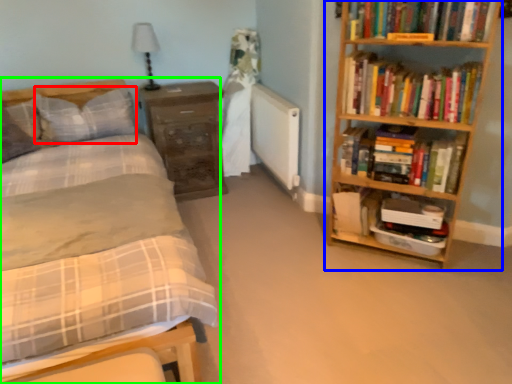
Question: Based on their relative distances, which object is farther from pillow (highlighted by a red box)? Choose from bookcase (highlighted by a blue box) and bed (highlighted by a green box).

Choices:
 (A) bookcase
 (B) bed

Answer: (A)